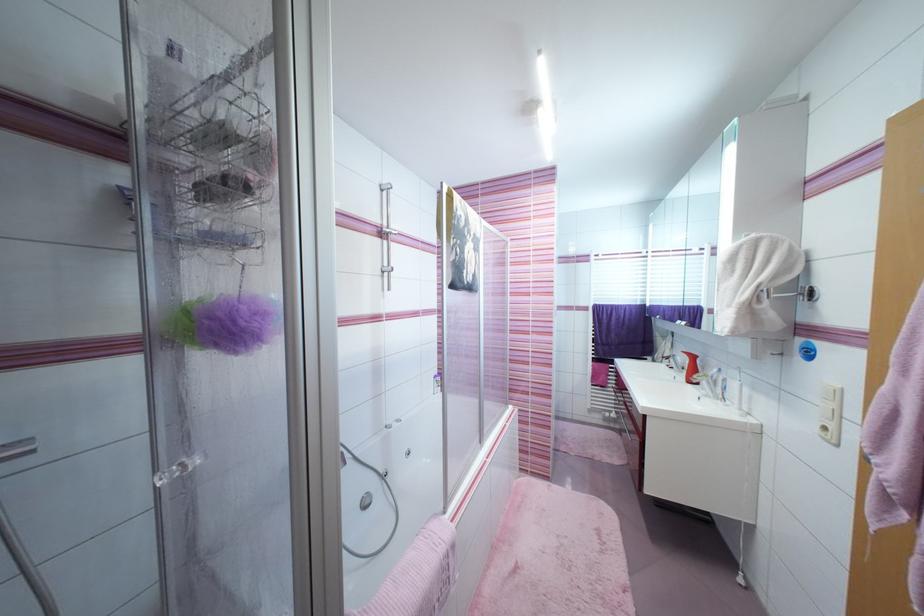
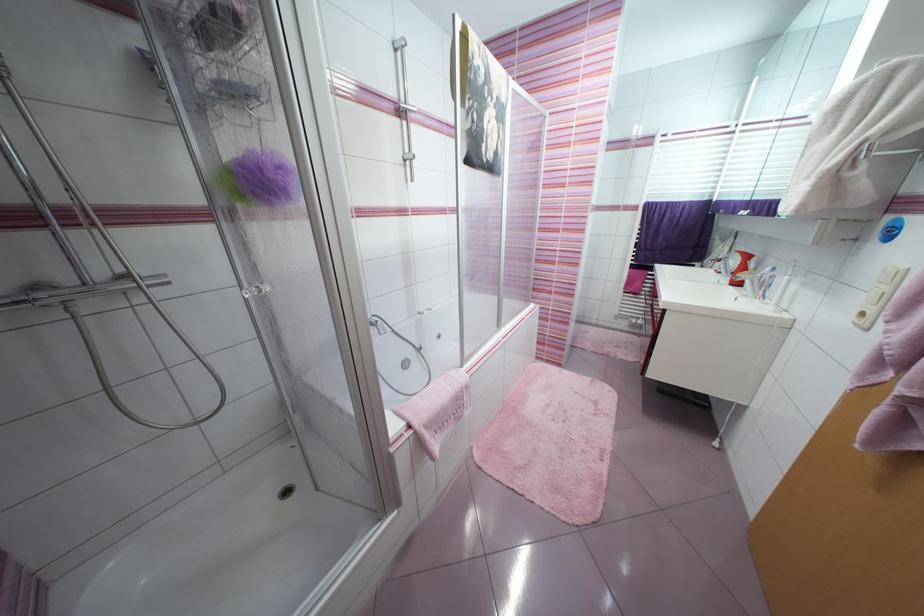
In a continuous first-person perspective shot, in which direction is the camera moving?

The cameraman moved toward right, backward.